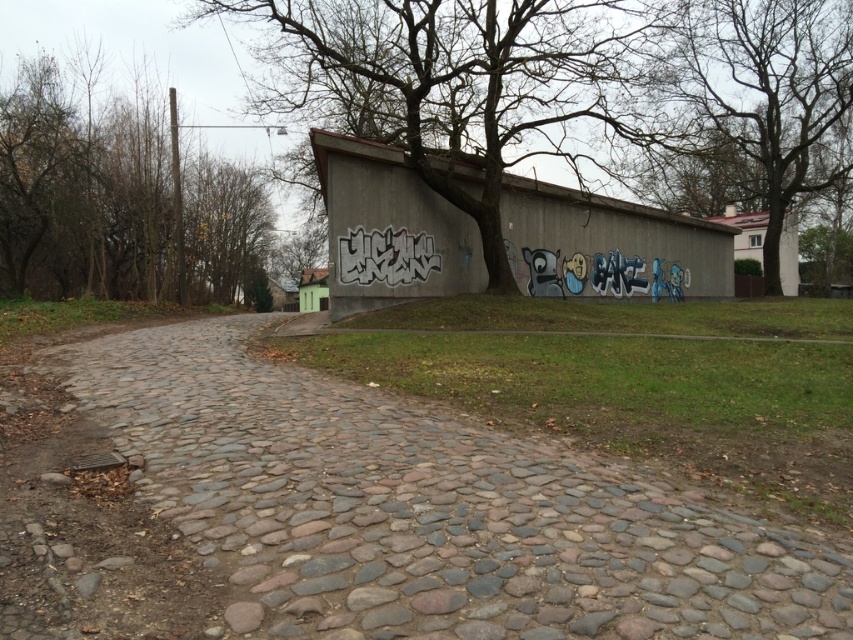
Does brown leafless tree at left have a smaller size compared to black graffiti at center?

No.

Does brown leafless tree at left appear on the right side of black graffiti at center?

In fact, brown leafless tree at left is to the left of black graffiti at center.

Locate an element on the screen. The image size is (853, 640). brown leafless tree at left is located at coordinates (115, 196).

Is point (460, 72) less distant than point (747, 42)?

Yes, point (460, 72) is closer to viewer.

This screenshot has width=853, height=640. In order to click on bare branches at center in this screenshot , I will do (451, 83).

Image resolution: width=853 pixels, height=640 pixels. What do you see at coordinates (451, 83) in the screenshot? I see `bare branches at center` at bounding box center [451, 83].

This screenshot has height=640, width=853. Identify the location of bare branches at center. (451, 83).

Between brown leafless tree at left and green leafy tree at upper center, which one has more height?

With more height is green leafy tree at upper center.

Measure the distance between brown leafless tree at left and green leafy tree at upper center.

brown leafless tree at left and green leafy tree at upper center are 32.49 meters apart.

Between point (27, 195) and point (756, 80), which one is positioned in front?

Point (27, 195)

Find the location of a particular element. brown leafless tree at left is located at coordinates (115, 196).